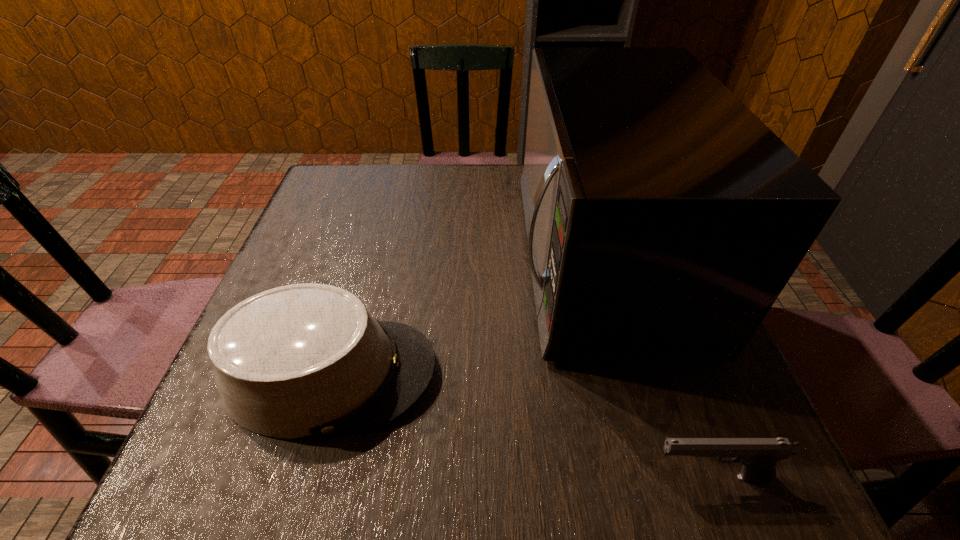
You are a GUI agent. You are given a task and a screenshot of the screen. Output one action in this format:
    pyautogui.click(x=<x>, y=<y>)
    Task: Click on the tallest object
    The height and width of the screenshot is (540, 960).
    Given the screenshot: What is the action you would take?
    pyautogui.click(x=664, y=218)

Find the location of a particular element. the leftmost object is located at coordinates (302, 360).

Image resolution: width=960 pixels, height=540 pixels. I want to click on pistol, so (x=759, y=456).

Image resolution: width=960 pixels, height=540 pixels. I want to click on free point located 0.050m with the door open on the microwave oven, so click(x=493, y=258).

I want to click on free region located with the door open on the microwave oven, so click(x=443, y=258).

What are the coordinates of `vacant space located 0.250m with the door open on the microwave oven` in the screenshot? It's located at (401, 258).

Identify the location of vacant region located 0.050m on the front-facing side of the hat. The height and width of the screenshot is (540, 960). (467, 373).

This screenshot has width=960, height=540. Find the location of `free location located 0.280m at the barrel of the nearest object`. free location located 0.280m at the barrel of the nearest object is located at coordinates (450, 477).

Where is `free location located at the barrel of the nearest object`? free location located at the barrel of the nearest object is located at coordinates (457, 477).

I want to click on vacant point located at the barrel of the nearest object, so click(x=379, y=477).